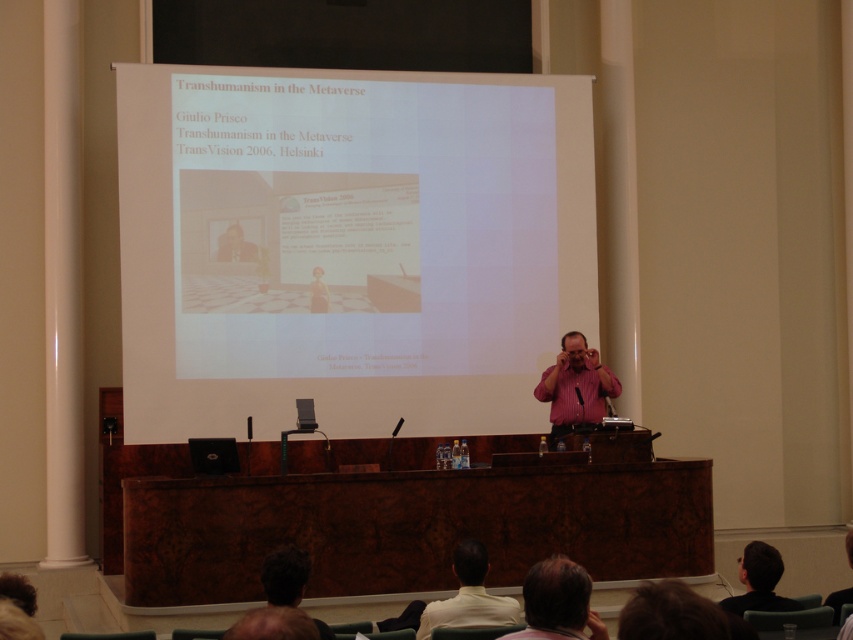
Measure the distance between light brown hair at lower center and camera.

light brown hair at lower center is 11.14 feet from camera.

The height and width of the screenshot is (640, 853). Describe the element at coordinates (558, 602) in the screenshot. I see `light brown hair at lower center` at that location.

The height and width of the screenshot is (640, 853). What are the coordinates of `light brown hair at lower center` in the screenshot? It's located at (558, 602).

Who is positioned more to the right, pink shirt at center or dark brown hair at lower right?

From the viewer's perspective, dark brown hair at lower right appears more on the right side.

Is pink shirt at center further to the viewer compared to dark brown hair at lower right?

Yes.

Who is more forward, (550, 440) or (752, 605)?

Positioned in front is point (752, 605).

Find the location of a particular element. The height and width of the screenshot is (640, 853). pink shirt at center is located at coordinates (575, 385).

Does point (567, 426) lie behind point (480, 596)?

Yes, it is.

Consider the image. Does pink shirt at center have a larger size compared to light beige shirt at lower center?

Indeed, pink shirt at center has a larger size compared to light beige shirt at lower center.

I want to click on pink shirt at center, so click(575, 385).

At what (x,y) coordinates should I click in order to perform the action: click on pink shirt at center. Please return your answer as a coordinate pair (x, y). The width and height of the screenshot is (853, 640). Looking at the image, I should click on (575, 385).